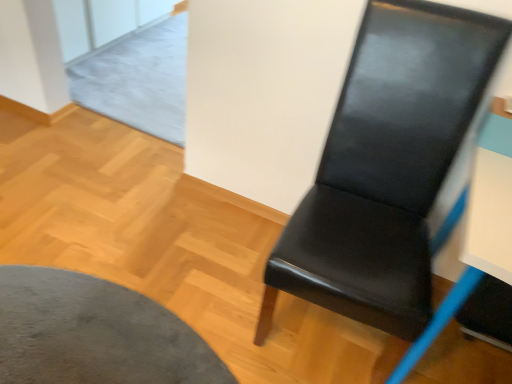
This screenshot has width=512, height=384. What do you see at coordinates (386, 167) in the screenshot? I see `black leather chair at right` at bounding box center [386, 167].

You are a GUI agent. You are given a task and a screenshot of the screen. Output one action in this format:
    pyautogui.click(x=<x>, y=<y>)
    Task: Click on the black leather chair at right
    This screenshot has width=512, height=384.
    Given the screenshot: What is the action you would take?
    pyautogui.click(x=386, y=167)

Measure the distance between point [403,167] and camera.

The distance of point [403,167] from camera is 4.51 feet.

The width and height of the screenshot is (512, 384). In order to click on black leather chair at right in this screenshot , I will do `click(386, 167)`.